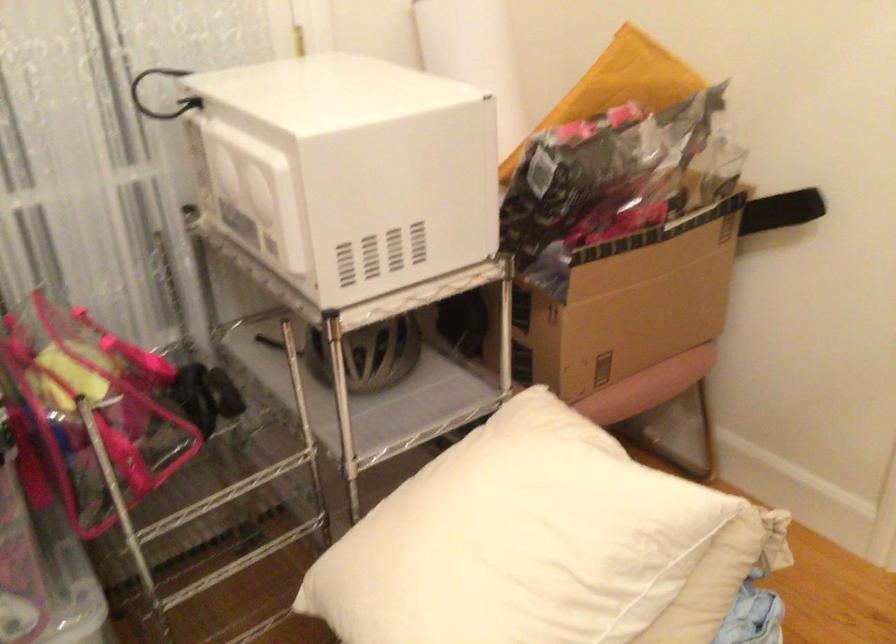
This screenshot has height=644, width=896. I want to click on white microwave button, so click(x=161, y=93).